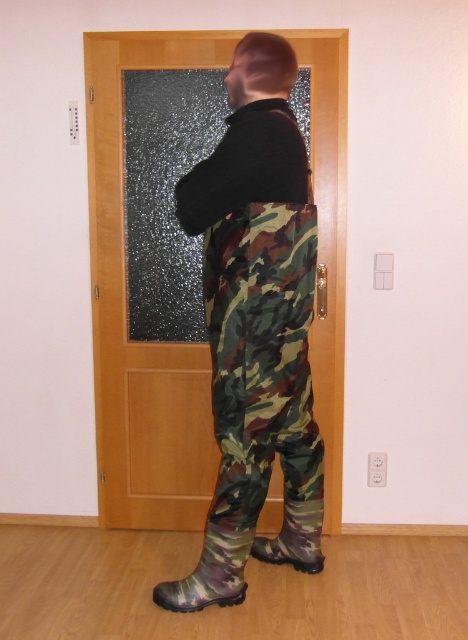
Question: Which of the following is the farthest from the observer?

Choices:
 (A) camouflage rubber boot at lower center
 (B) wooden door at center

Answer: (B)

Question: Does wooden door at center appear on the right side of camouflage rubber boot at lower center?

Choices:
 (A) no
 (B) yes

Answer: (A)

Question: Where is wooden door at center located in relation to camouflage rubber boot at lower center in the image?

Choices:
 (A) above
 (B) below

Answer: (A)

Question: Among these objects, which one is nearest to the camera?

Choices:
 (A) camouflage rubber boot at lower center
 (B) wooden door at center

Answer: (A)

Question: Is the position of wooden door at center more distant than that of camouflage rubber boot at lower center?

Choices:
 (A) no
 (B) yes

Answer: (B)